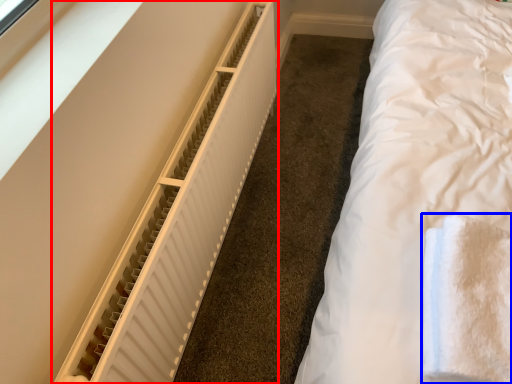
Question: Which object appears farthest to the camera in this image, radiator (highlighted by a red box) or cloth (highlighted by a blue box)?

Choices:
 (A) radiator
 (B) cloth

Answer: (A)